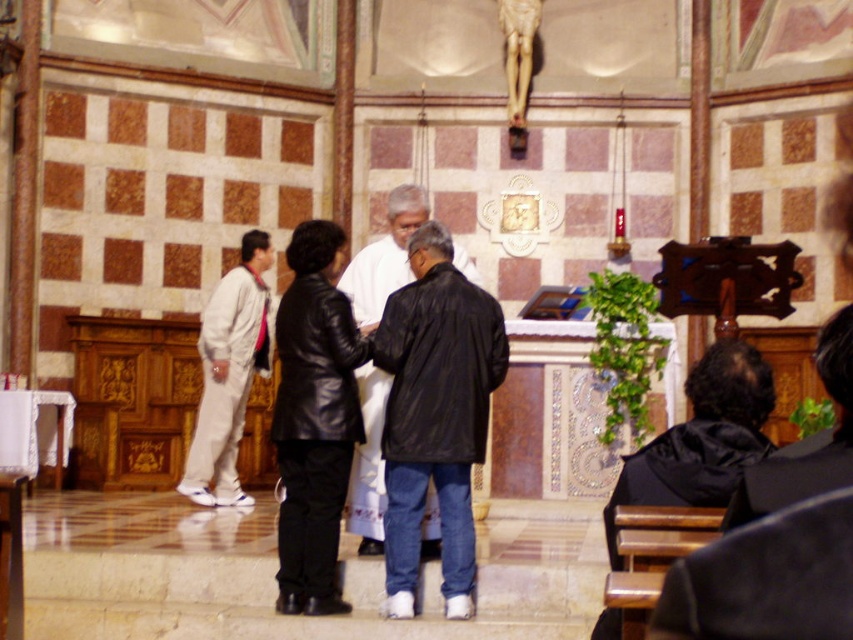
Is black leather jacket at lower right in front of black leather jacket at center?

Yes, black leather jacket at lower right is closer to the viewer.

Between point (727, 465) and point (375, 540), which one is positioned behind?

Positioned behind is point (375, 540).

Where is `black leather jacket at lower right`? black leather jacket at lower right is located at coordinates (701, 438).

Is black leather jacket at lower right above light beige fabric pants at left?

No.

Which is more to the left, black leather jacket at lower right or light beige fabric pants at left?

light beige fabric pants at left is more to the left.

This screenshot has height=640, width=853. Find the location of `black leather jacket at lower right`. black leather jacket at lower right is located at coordinates (701, 438).

Is light beige fabric pants at left wider than black leather jacket at center?

Correct, the width of light beige fabric pants at left exceeds that of black leather jacket at center.

Is point (231, 404) farther from viewer compared to point (364, 509)?

Yes, point (231, 404) is farther from viewer.

Where is `light beige fabric pants at left`? The height and width of the screenshot is (640, 853). light beige fabric pants at left is located at coordinates (229, 372).